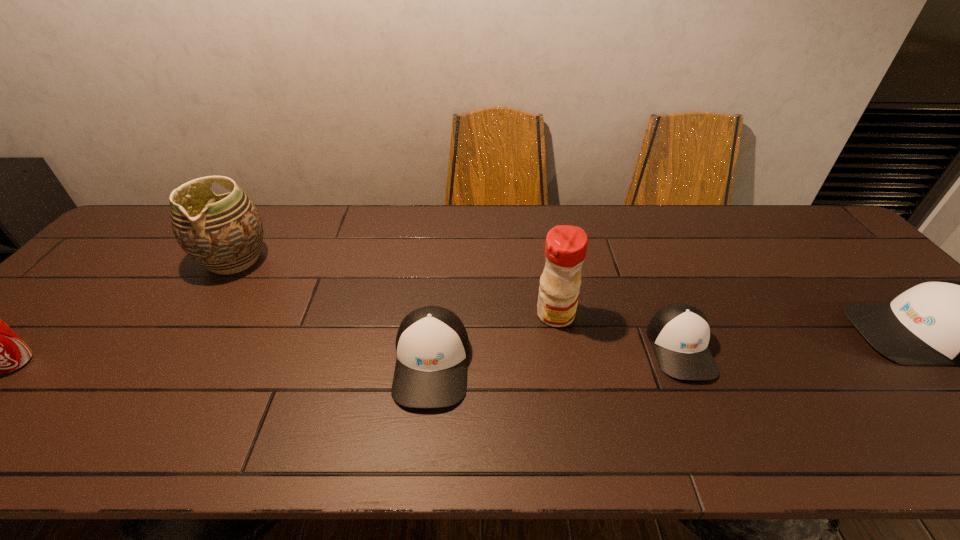
This screenshot has height=540, width=960. In the image, there is a desktop. Identify the location of free space at the far edge. (334, 220).

In the image, there is a desktop. What are the coordinates of `free region at the near edge` in the screenshot? It's located at (564, 406).

The width and height of the screenshot is (960, 540). Find the location of `free space at the left edge of the desktop`. free space at the left edge of the desktop is located at coordinates (143, 270).

Image resolution: width=960 pixels, height=540 pixels. I want to click on blank space at the far left corner, so click(118, 244).

You are a GUI agent. You are given a task and a screenshot of the screen. Output one action in this format:
    pyautogui.click(x=<x>, y=<y>)
    Task: Click on the empty space that is in between the fifth object from right to left and the shortest object
    Image resolution: width=960 pixels, height=540 pixels.
    Given the screenshot: What is the action you would take?
    pyautogui.click(x=458, y=304)

The image size is (960, 540). I want to click on empty space between the second shortest cap and the second cap from left to right, so click(x=556, y=356).

Identify the location of empty location between the farthest object and the condiment. (396, 287).

You are a GUI agent. You are given a task and a screenshot of the screen. Output one action in this format:
    pyautogui.click(x=<x>, y=<y>)
    Task: Click on the vacant region between the second cap from right to left and the leftmost cap
    
    Given the screenshot: What is the action you would take?
    pyautogui.click(x=556, y=356)

Locate an element on the screen. free spot between the third object from left to right and the second cap from right to left is located at coordinates (556, 356).

Locate which object is the fifth closest to the pottery. Please provide its 2D coordinates. Your answer should be formatted as a tuple, i.e. [(x, y)], where the tuple contains the x and y coordinates of a point satisfying the conditions above.

[(944, 322)]